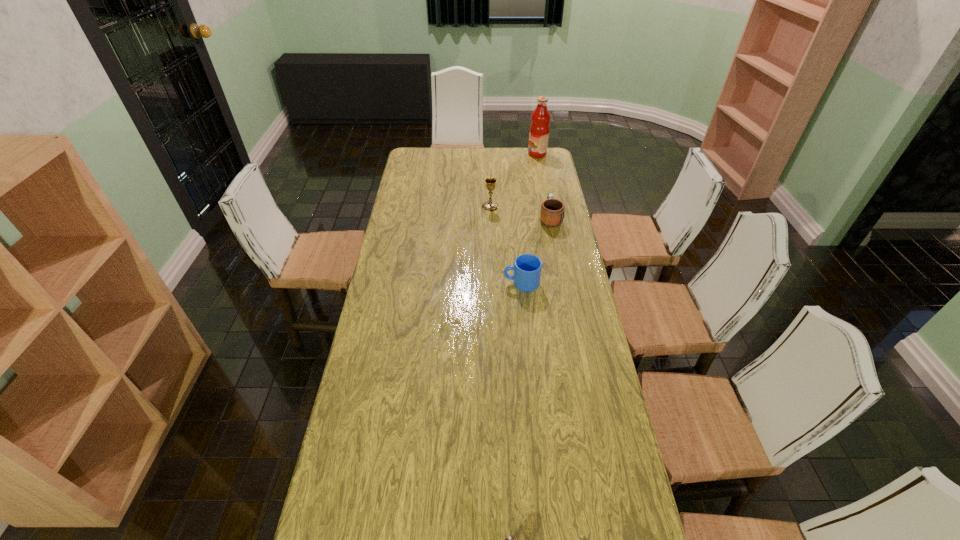
Find the location of a particular element. unoccupied area between the farthest object and the right mug is located at coordinates (543, 186).

The width and height of the screenshot is (960, 540). I want to click on object that is the third nearest to the nearer mug, so click(510, 539).

In order to click on object that is the closest to the chalice in this screenshot , I will do `click(552, 210)`.

Identify the location of free space that satisfies the following two spatial constraints: 1. on the front label of the tallest object; 2. on the side of the right mug with the handle. The image size is (960, 540). (549, 219).

Locate an element on the screen. The width and height of the screenshot is (960, 540). free space that satisfies the following two spatial constraints: 1. on the side of the right mug with the handle; 2. on the front label of the farthest object is located at coordinates (538, 154).